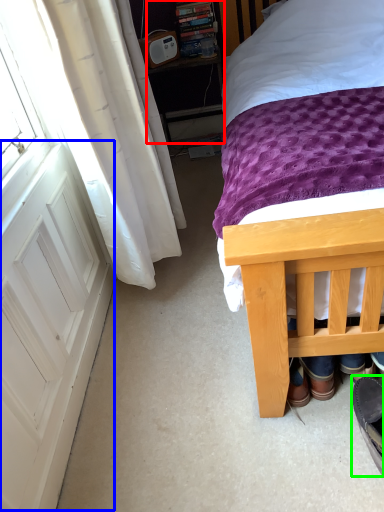
Question: Which is nearer to the nightstand (highlighted by a red box)? screen door (highlighted by a blue box) or footwear (highlighted by a green box).

Choices:
 (A) screen door
 (B) footwear

Answer: (A)